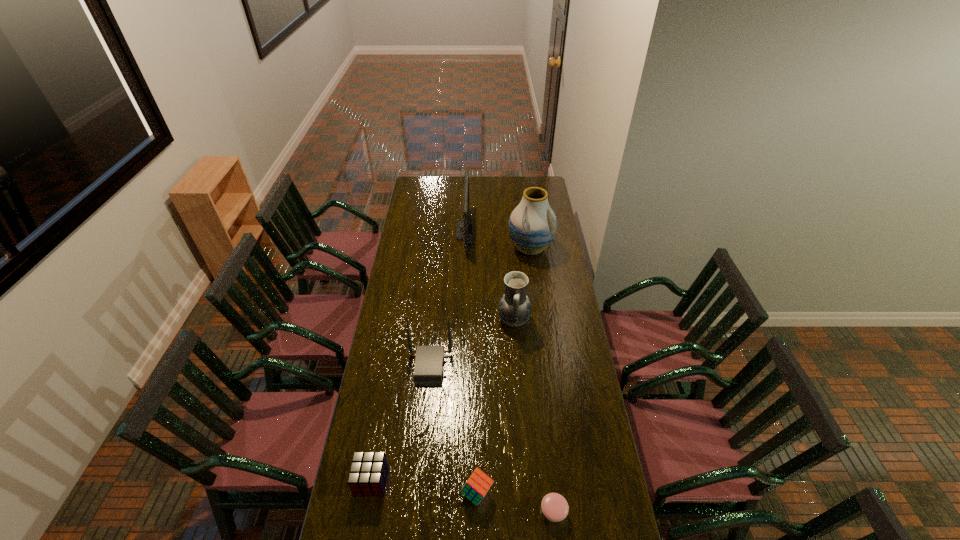
This screenshot has height=540, width=960. In the image, there is a desktop. In order to click on vacant space at the far edge in this screenshot , I will do `click(455, 193)`.

You are a GUI agent. You are given a task and a screenshot of the screen. Output one action in this format:
    pyautogui.click(x=<x>, y=<y>)
    Task: Click on the vacant space at the left edge
    Image resolution: width=960 pixels, height=540 pixels.
    Given the screenshot: What is the action you would take?
    pyautogui.click(x=399, y=306)

This screenshot has height=540, width=960. Find the location of `vacant space at the right edge of the desktop`. vacant space at the right edge of the desktop is located at coordinates (560, 288).

Identify the location of free location at the far left corner. The height and width of the screenshot is (540, 960). (x=412, y=185).

The image size is (960, 540). In the image, there is a desktop. Identify the location of vacant region at the far right corner. (548, 187).

Find the location of a particular element. Image resolution: width=960 pixels, height=540 pixels. vacant area between the leftmost object and the tallest object is located at coordinates (451, 364).

This screenshot has height=540, width=960. Identify the location of empty space that is in between the monitor and the cupcake. (509, 372).

I want to click on vacant space in between the shortest object and the monitor, so click(509, 372).

At what (x,y) coordinates should I click in order to perform the action: click on vacant space in between the shortest object and the leftmost object. Please return your answer as a coordinate pair (x, y). The width and height of the screenshot is (960, 540). Looking at the image, I should click on (463, 496).

The width and height of the screenshot is (960, 540). Identify the location of empty space between the fourth farthest object and the right cube. (453, 430).